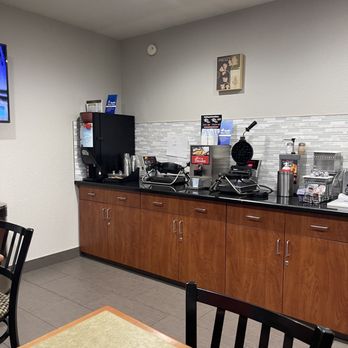
The image size is (348, 348). I want to click on locks, so click(x=108, y=223), click(x=180, y=237), click(x=286, y=263).